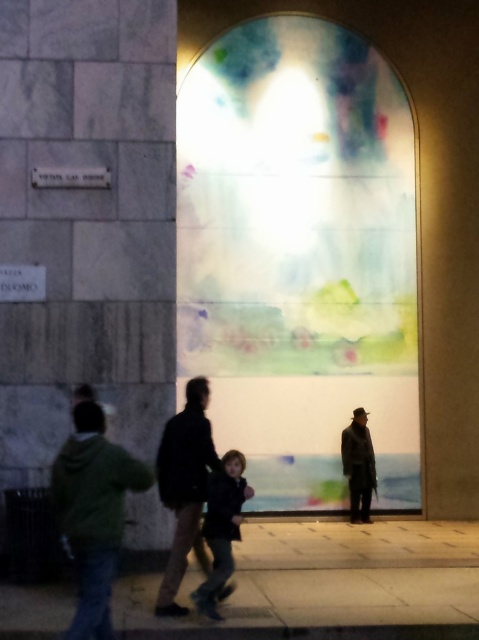
Describe the element at coordinates (184, 486) in the screenshot. I see `dark brown leather jacket at center` at that location.

Does point (202, 394) come closer to viewer compared to point (200, 609)?

No, (202, 394) is further to viewer.

Locate an element on the screen. dark brown leather jacket at center is located at coordinates (184, 486).

Can you confirm if green matte jacket at lower left is taller than dark brown leather jacket at center?

In fact, green matte jacket at lower left may be shorter than dark brown leather jacket at center.

Locate an element on the screen. green matte jacket at lower left is located at coordinates (93, 513).

Does green matte jacket at lower left have a greater height compared to dark blue jacket at center?

Yes.

Which is more to the right, green matte jacket at lower left or dark blue jacket at center?

Positioned to the right is dark blue jacket at center.

Locate an element on the screen. This screenshot has height=640, width=479. green matte jacket at lower left is located at coordinates (93, 513).